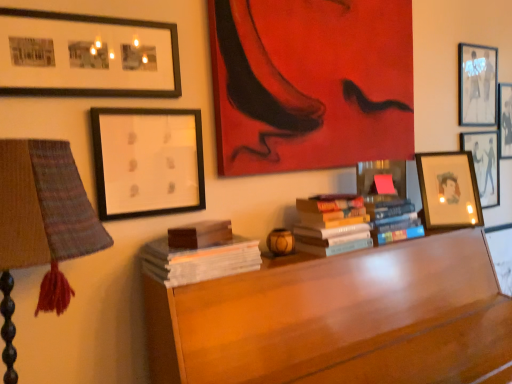
Question: Is hardcover books at center, marked as the 3th book in a left-to-right arrangement, oriented towards white paper at upper left, the sixth picture frame positioned from the right?

Choices:
 (A) no
 (B) yes

Answer: (A)

Question: Is hardcover books at center, the second book in the right-to-left sequence, positioned with its back to white paper at upper left, which ranks as the 2th picture frame in left-to-right order?

Choices:
 (A) no
 (B) yes

Answer: (A)

Question: From the image's perspective, does hardcover books at center, marked as the 3th book in a left-to-right arrangement, appear higher than white paper at upper left, the sixth picture frame positioned from the right?

Choices:
 (A) yes
 (B) no

Answer: (B)

Question: Considering the relative positions of hardcover books at center, marked as the 3th book in a left-to-right arrangement, and white paper at upper left, which ranks as the 2th picture frame in left-to-right order, in the image provided, is hardcover books at center, marked as the 3th book in a left-to-right arrangement, to the right of white paper at upper left, which ranks as the 2th picture frame in left-to-right order, from the viewer's perspective?

Choices:
 (A) no
 (B) yes

Answer: (B)

Question: Considering the relative sizes of hardcover books at center, the second book in the right-to-left sequence, and white paper at upper left, the sixth picture frame positioned from the right, in the image provided, is hardcover books at center, the second book in the right-to-left sequence, thinner than white paper at upper left, the sixth picture frame positioned from the right,?

Choices:
 (A) yes
 (B) no

Answer: (B)

Question: Is hardcover books at center, the second book in the right-to-left sequence, completely or partially outside of white paper at upper left, the sixth picture frame positioned from the right?

Choices:
 (A) no
 (B) yes

Answer: (B)

Question: From a real-world perspective, is matte red painting at upper center, acting as the third picture frame starting from the left, positioned under white paper at upper left, which ranks as the 2th picture frame in left-to-right order, based on gravity?

Choices:
 (A) no
 (B) yes

Answer: (A)

Question: Is matte red painting at upper center, acting as the third picture frame starting from the left, at the left side of white paper at upper left, the sixth picture frame positioned from the right?

Choices:
 (A) yes
 (B) no

Answer: (B)

Question: Does matte red painting at upper center, which is the 5th picture frame from right to left, have a greater width compared to white paper at upper left, which ranks as the 2th picture frame in left-to-right order?

Choices:
 (A) no
 (B) yes

Answer: (B)

Question: From the image's perspective, is matte red painting at upper center, acting as the third picture frame starting from the left, over white paper at upper left, which ranks as the 2th picture frame in left-to-right order?

Choices:
 (A) no
 (B) yes

Answer: (B)

Question: Does matte red painting at upper center, acting as the third picture frame starting from the left, come behind white paper at upper left, the sixth picture frame positioned from the right?

Choices:
 (A) yes
 (B) no

Answer: (A)

Question: Is matte red painting at upper center, which is the 5th picture frame from right to left, at the right side of white paper at upper left, the sixth picture frame positioned from the right?

Choices:
 (A) yes
 (B) no

Answer: (A)

Question: Can we say matte black picture frame at upper right, the third picture frame from the right, lies outside matte black framed photos at upper left, which appears as the first picture frame when viewed from the left?

Choices:
 (A) yes
 (B) no

Answer: (A)